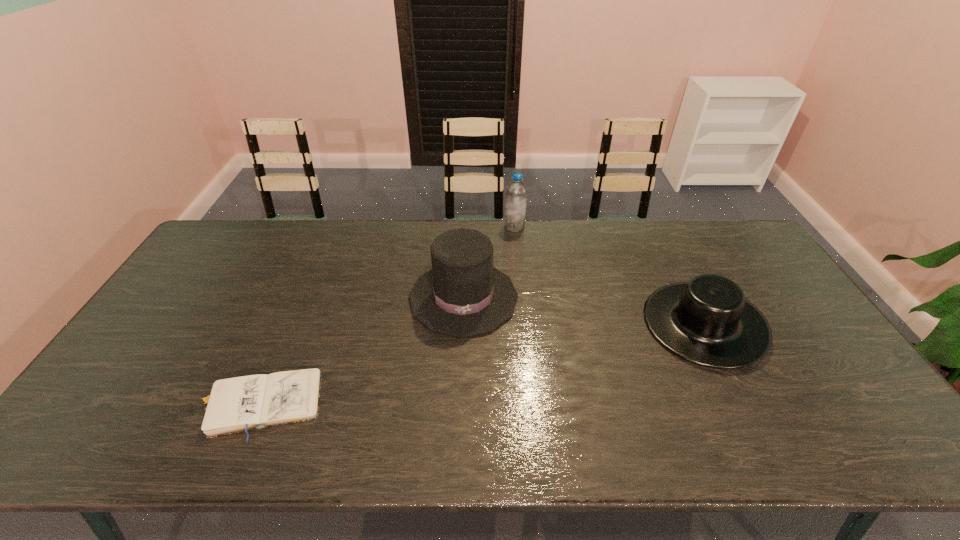
I want to click on the farthest object, so click(516, 192).

Identify the location of the left dress hat. The width and height of the screenshot is (960, 540). (463, 295).

At what (x,y) coordinates should I click in order to perform the action: click on the shorter dress hat. Please return your answer as a coordinate pair (x, y). The height and width of the screenshot is (540, 960). Looking at the image, I should click on (707, 320).

You are a GUI agent. You are given a task and a screenshot of the screen. Output one action in this format:
    pyautogui.click(x=<x>, y=<y>)
    Task: Click on the rightmost object
    The image size is (960, 540).
    Given the screenshot: What is the action you would take?
    pyautogui.click(x=707, y=320)

At what (x,y) coordinates should I click in order to perform the action: click on notebook. Please return your answer as a coordinate pair (x, y). This screenshot has height=540, width=960. Looking at the image, I should click on (235, 404).

Locate an element on the screen. the shortest object is located at coordinates (235, 404).

The width and height of the screenshot is (960, 540). In order to click on vacant space situated on the right of the water bottle in this screenshot , I will do pos(612,227).

Locate an element on the screen. free space located 0.230m on the front of the left dress hat with the decoration is located at coordinates point(459,414).

The image size is (960, 540). Identify the location of blank area located 0.280m on the back of the right dress hat. (658, 231).

I want to click on vacant position located on the back of the notebook, so click(x=298, y=312).